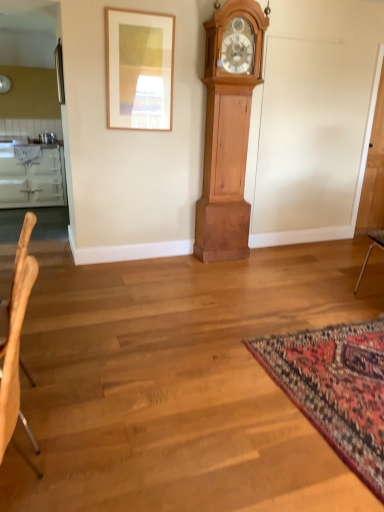
At what (x,y) coordinates should I click in order to perform the action: click on free area in between light brown wood grandfather clock at center and light brown wood chair at left. Please return your answer as a coordinate pair (x, y). This screenshot has width=384, height=512. Looking at the image, I should click on (167, 343).